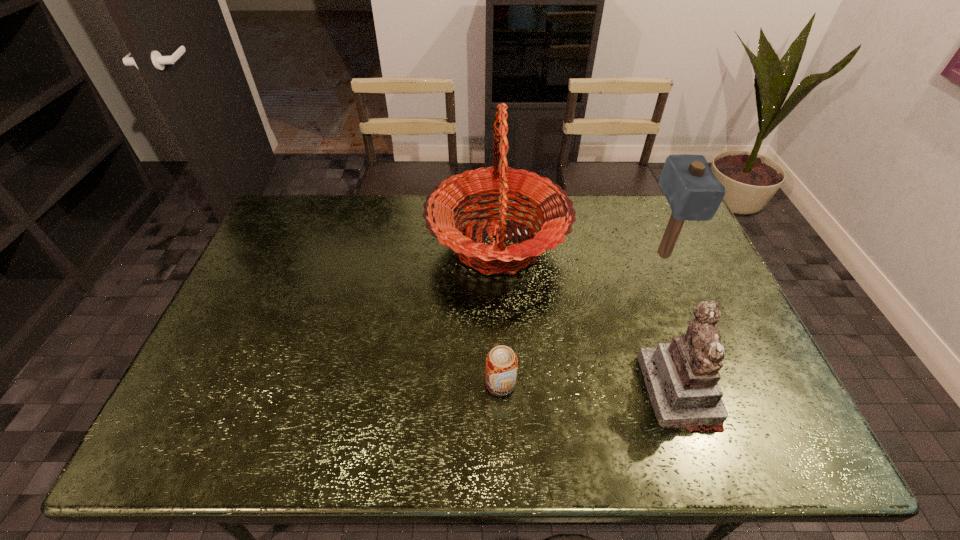
I want to click on the tallest object, so click(x=553, y=208).

Locate an element on the screen. The width and height of the screenshot is (960, 540). mallet is located at coordinates (693, 192).

Locate an element on the screen. The image size is (960, 540). the third tallest object is located at coordinates (681, 377).

Image resolution: width=960 pixels, height=540 pixels. Find the location of `beer can`. beer can is located at coordinates (501, 362).

The image size is (960, 540). I want to click on free space located 0.320m on the front of the basket, so [504, 399].

You are a GUI agent. You are given a task and a screenshot of the screen. Output one action in this format:
    pyautogui.click(x=<x>, y=<y>)
    Task: Click on the free spot located on the back of the mallet
    The image size is (960, 540).
    Given the screenshot: What is the action you would take?
    pyautogui.click(x=639, y=198)

At what (x,y) coordinates should I click in order to perform the action: click on vacant space located 0.240m on the front-facing side of the figurine. Please return your answer as a coordinate pair (x, y). The height and width of the screenshot is (540, 960). Looking at the image, I should click on (548, 391).

The width and height of the screenshot is (960, 540). Find the location of `vacant region located on the front-facing side of the figurine`. vacant region located on the front-facing side of the figurine is located at coordinates (568, 391).

Where is `vacant space located on the front-facing side of the figurine`? The height and width of the screenshot is (540, 960). vacant space located on the front-facing side of the figurine is located at coordinates (564, 391).

Where is `vacant space situated 0.270m on the left of the beer can`? This screenshot has width=960, height=540. vacant space situated 0.270m on the left of the beer can is located at coordinates (376, 384).